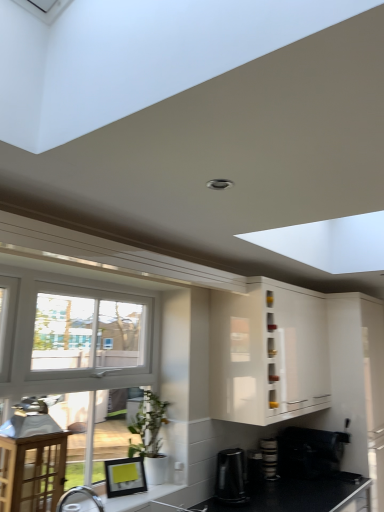
Question: Is black plastic coffee maker at lower center, acting as the 4th appliance starting from the right, in front of or behind black plastic coffee maker at lower center, the 2th appliance positioned from the left, in the image?

Choices:
 (A) behind
 (B) front

Answer: (B)

Question: In terms of width, does black plastic coffee maker at lower center, which is the 1th appliance from left to right, look wider or thinner when compared to black plastic coffee maker at lower center, acting as the 3th appliance starting from the right?

Choices:
 (A) thin
 (B) wide

Answer: (B)

Question: Which object is positioned closest to the black matte coffee maker at lower right, arranged as the 1th appliance when viewed from the right?

Choices:
 (A) white matte pot at lower center
 (B) white glossy cabinet at upper center
 (C) black matte countertop at lower right
 (D) stacked plates at lower right, which is the 3th appliance from left to right
 (E) wooden table at left

Answer: (D)

Question: Considering the real-world distances, which object is closest to the white glossy cabinet at upper center?

Choices:
 (A) white matte pot at lower center
 (B) black matte coffee maker at lower right, arranged as the 1th appliance when viewed from the right
 (C) black plastic coffee maker at lower center, acting as the 3th appliance starting from the right
 (D) black plastic coffee maker at lower center, which is the 1th appliance from left to right
 (E) stacked plates at lower right, which appears as the 2th appliance when viewed from the right

Answer: (D)